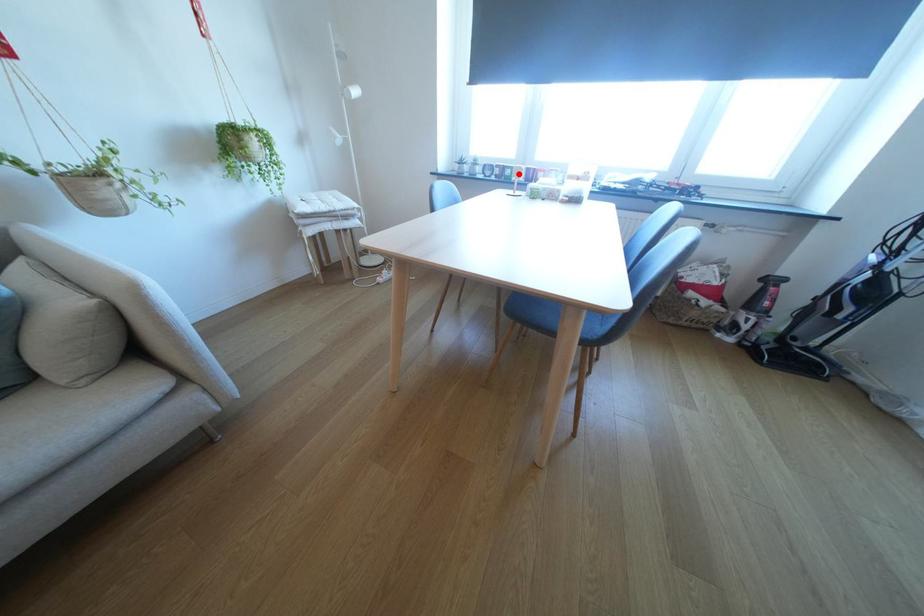
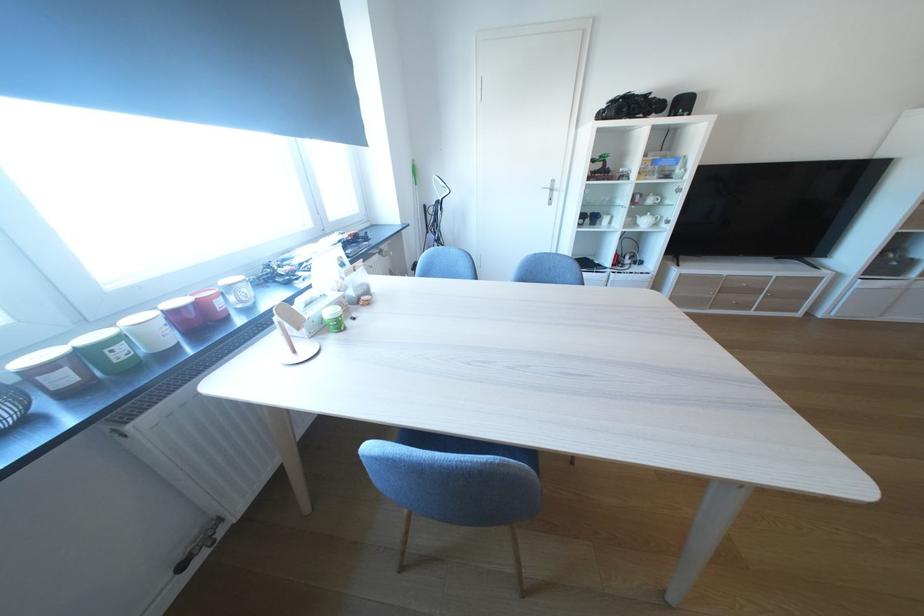
Where in the second image is the point corresponding to the highlighted location from the first image?

(129, 354)